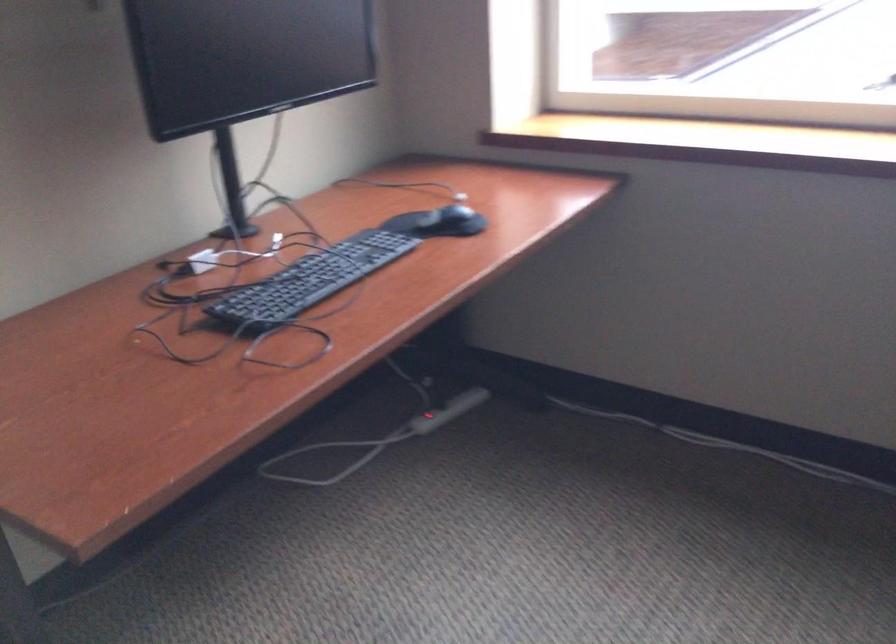
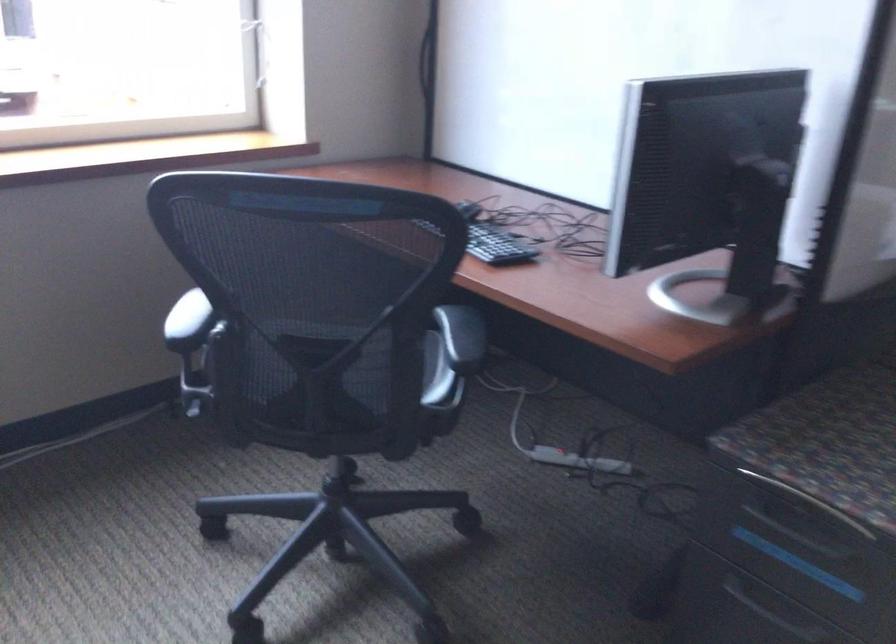
Question: The camera is either moving clockwise (left) or counter-clockwise (right) around the object. The first image is from the beginning of the video and the second image is from the end. Is the camera moving left or right when shooting the video?

Choices:
 (A) Left
 (B) Right

Answer: (A)